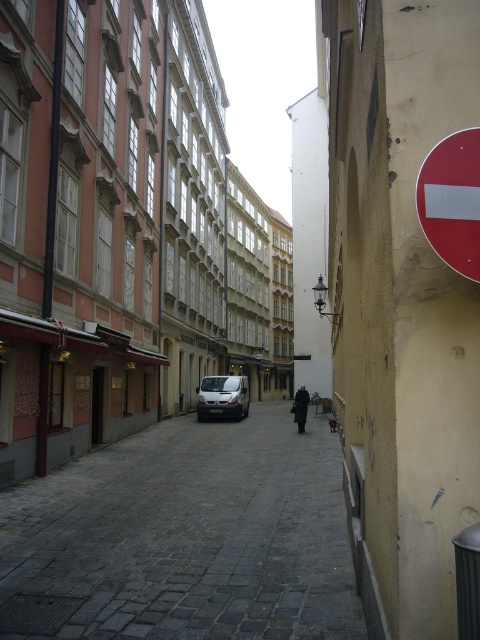
Question: Does gray cobblestone pavement at center lie behind red matte sign at right?

Choices:
 (A) yes
 (B) no

Answer: (A)

Question: Which point appears farthest from the camera in this image?

Choices:
 (A) (197, 401)
 (B) (4, 561)

Answer: (A)

Question: Which point is closer to the camera?

Choices:
 (A) (173, 592)
 (B) (418, 209)
 (C) (219, 384)
 (D) (43, 276)

Answer: (B)

Question: Is red matte sign at right smaller than black metal pole at left?

Choices:
 (A) no
 (B) yes

Answer: (B)

Question: Is the position of black metal pole at left more distant than that of silver metallic van at center?

Choices:
 (A) yes
 (B) no

Answer: (B)

Question: Which point is closer to the camera?

Choices:
 (A) (61, 40)
 (B) (201, 413)
 (C) (289, 577)
 (D) (460, 211)

Answer: (D)